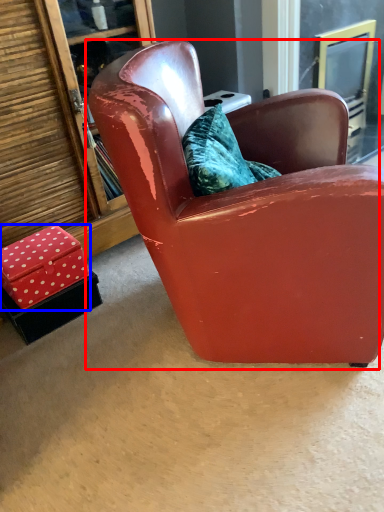
Question: Which object is closer to the camera taking this photo, chair (highlighted by a red box) or box (highlighted by a blue box)?

Choices:
 (A) chair
 (B) box

Answer: (A)